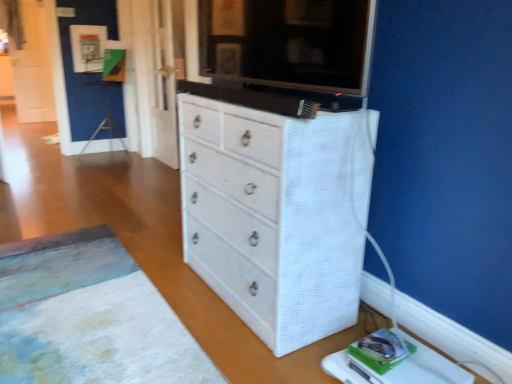
Question: From a real-world perspective, is white textured changing table at lower right over white textured rug at lower left?

Choices:
 (A) no
 (B) yes

Answer: (B)

Question: Is the depth of white textured changing table at lower right greater than that of white textured rug at lower left?

Choices:
 (A) yes
 (B) no

Answer: (A)

Question: Is white textured changing table at lower right oriented towards white textured rug at lower left?

Choices:
 (A) no
 (B) yes

Answer: (A)

Question: Is white textured changing table at lower right bigger than white textured rug at lower left?

Choices:
 (A) no
 (B) yes

Answer: (A)

Question: From the image's perspective, is white textured changing table at lower right on top of white textured rug at lower left?

Choices:
 (A) yes
 (B) no

Answer: (B)

Question: Can you confirm if white textured changing table at lower right is thinner than white textured rug at lower left?

Choices:
 (A) yes
 (B) no

Answer: (A)

Question: Is white textured cabinet at upper center shorter than white textured rug at lower left?

Choices:
 (A) no
 (B) yes

Answer: (A)

Question: Is white textured cabinet at upper center thinner than white textured rug at lower left?

Choices:
 (A) yes
 (B) no

Answer: (A)

Question: Is white textured cabinet at upper center to the left of white textured rug at lower left from the viewer's perspective?

Choices:
 (A) yes
 (B) no

Answer: (B)

Question: Is white textured cabinet at upper center not within white textured rug at lower left?

Choices:
 (A) no
 (B) yes

Answer: (B)

Question: From the image's perspective, is white textured cabinet at upper center above white textured rug at lower left?

Choices:
 (A) yes
 (B) no

Answer: (A)

Question: Is white textured cabinet at upper center taller than white textured rug at lower left?

Choices:
 (A) no
 (B) yes

Answer: (B)

Question: Is white textured rug at lower left aimed at white textured cabinet at upper center?

Choices:
 (A) yes
 (B) no

Answer: (B)